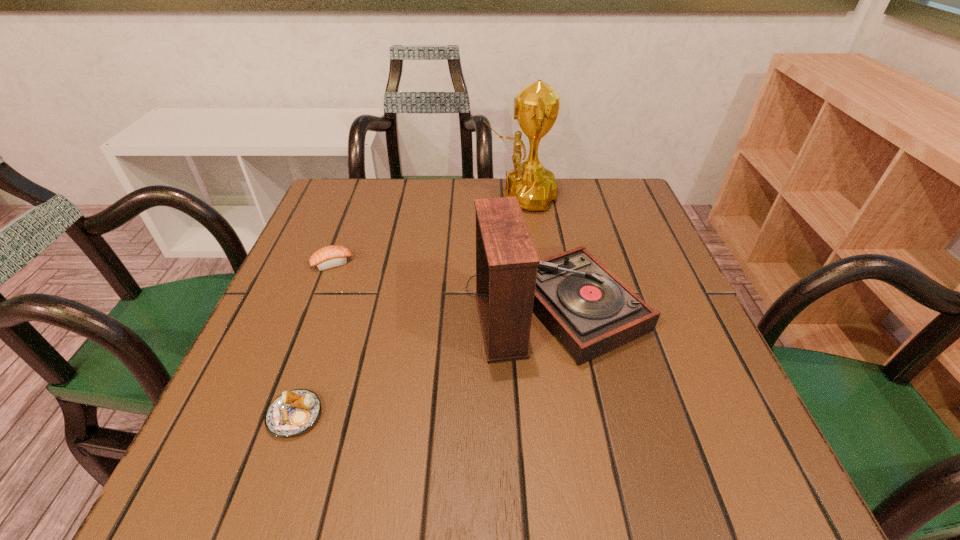
At what (x,y) coordinates should I click in order to perform the action: click on blank space located on the back of the sushi. Please return your answer as a coordinate pair (x, y). Looking at the image, I should click on (x=358, y=195).

Find the location of a particular element. This screenshot has height=540, width=960. free spot located on the right of the shortest object is located at coordinates (431, 415).

In order to click on object positioned at the far edge in this screenshot , I will do `click(536, 106)`.

Locate an element on the screen. object present at the near edge is located at coordinates (292, 413).

Find the location of a particular element. sushi present at the left edge is located at coordinates (333, 256).

You are a GUI agent. You are given a task and a screenshot of the screen. Output one action in this format:
    pyautogui.click(x=<x>, y=<y>)
    Task: Click on the pastry present at the left edge
    
    Given the screenshot: What is the action you would take?
    pyautogui.click(x=292, y=413)

You are a GUI agent. You are given a task and a screenshot of the screen. Output one action in this format:
    pyautogui.click(x=<x>, y=<y>)
    Task: Click on the object that is at the right edge
    
    Given the screenshot: What is the action you would take?
    pyautogui.click(x=590, y=311)

Where is `object located in the near left corner section of the desktop`? The image size is (960, 540). object located in the near left corner section of the desktop is located at coordinates (292, 413).

This screenshot has width=960, height=540. What are the coordinates of `vacant space at the far edge of the desktop` in the screenshot? It's located at (583, 230).

Locate an element on the screen. free location at the near edge is located at coordinates (635, 445).